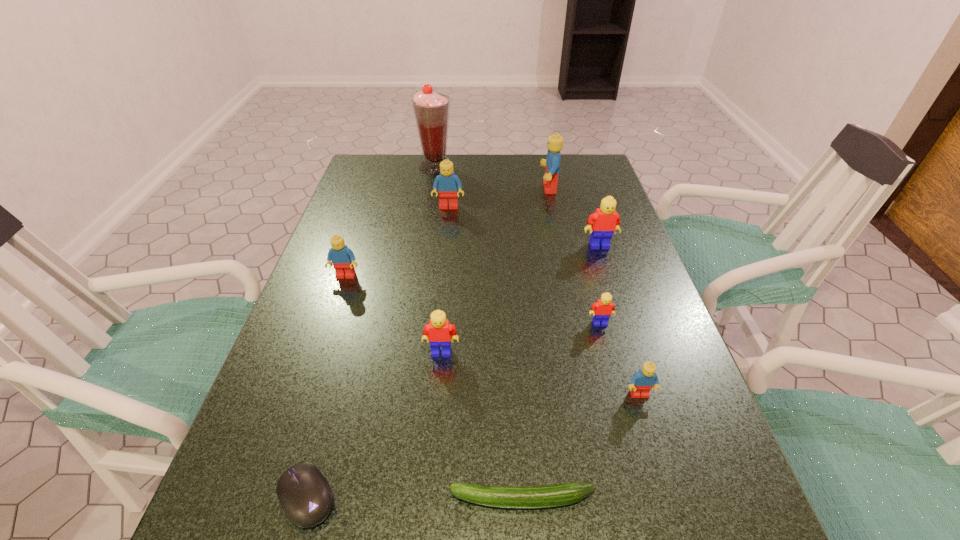
The image size is (960, 540). In the image, there is a desktop. Identify the location of vacant space at the far left corner. (379, 186).

The width and height of the screenshot is (960, 540). In the image, there is a desktop. Find the location of `vacant space at the far right corner`. vacant space at the far right corner is located at coordinates (577, 173).

At what (x,y) coordinates should I click in order to perform the action: click on free space between the nearest Lego and the fifth farthest Lego. Please return your answer as a coordinate pair (x, y). Looking at the image, I should click on (620, 359).

The height and width of the screenshot is (540, 960). I want to click on vacant space that is in between the ninth shortest object and the nearest yellow Lego, so click(495, 270).

Where is `free space between the nearest Lego and the tallest Lego`? This screenshot has height=540, width=960. free space between the nearest Lego and the tallest Lego is located at coordinates (594, 292).

Image resolution: width=960 pixels, height=540 pixels. In order to click on free area in between the second nearest yellow Lego and the biggest blue Lego in this screenshot , I will do `click(574, 256)`.

Locate an element on the screen. The width and height of the screenshot is (960, 540). vacant area between the sixth nearest object and the second shortest object is located at coordinates (326, 386).

Find the location of a particular element. free space between the ninth shortest object and the shortest object is located at coordinates (536, 343).

I want to click on unoccupied position between the second blue Lego from right to left and the nearest yellow Lego, so [x=495, y=270].

I want to click on vacant point located between the computer mouse and the shortest object, so click(x=415, y=498).